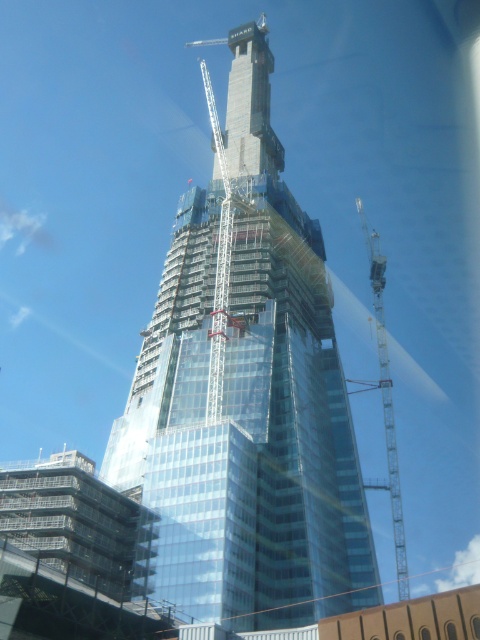
You are a construction worker standing at the base of the transparent glass tower at center. You need to reach the top of the metallic gray crane at right. Which direction should you move relative to the tower?

The transparent glass tower at center is positioned over the metallic gray crane at right, so you should move downward and to the right relative to the tower to reach the top of the metallic gray crane at right.